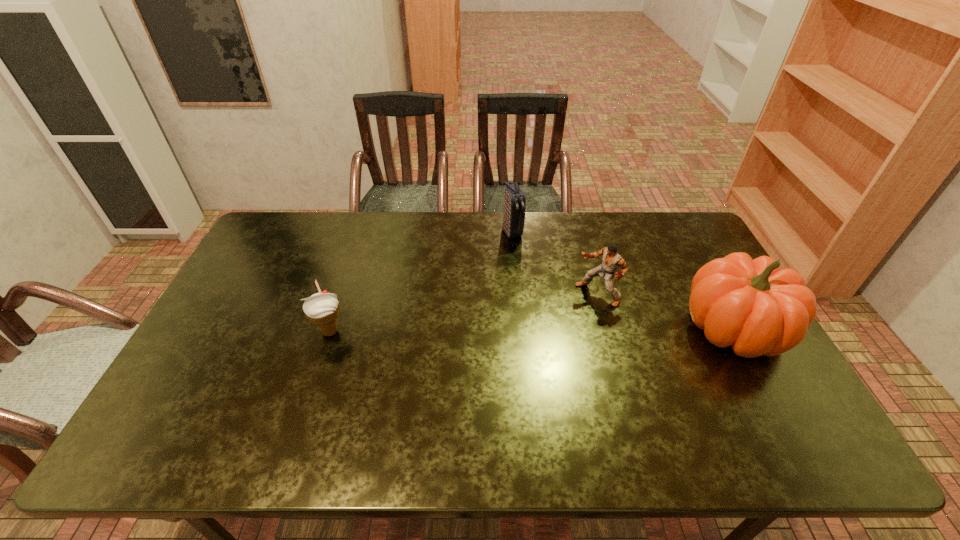
Find the location of `the leftmost object`. the leftmost object is located at coordinates pos(322,309).

Where is `the tallest object`? the tallest object is located at coordinates (751, 305).

You are a GUI agent. You are given a task and a screenshot of the screen. Output one action in this format:
    pyautogui.click(x=<x>, y=<y>)
    Task: Click on the pumpkin
    The width and height of the screenshot is (960, 540).
    Given the screenshot: What is the action you would take?
    pyautogui.click(x=751, y=305)

Where is `the farthest object`? The image size is (960, 540). the farthest object is located at coordinates (514, 199).

This screenshot has width=960, height=540. I want to click on the third object from right to left, so click(514, 199).

The image size is (960, 540). Find the location of `puncher`. puncher is located at coordinates (611, 260).

You are a GUI agent. You are given a task and a screenshot of the screen. Output one action in this format:
    pyautogui.click(x=<x>, y=<y>)
    Task: Click on the vacant region located on the back of the icecream
    This screenshot has width=960, height=540.
    Given the screenshot: What is the action you would take?
    pyautogui.click(x=352, y=263)

At what (x,y) coordinates should I click in order to perform the action: click on vacant space located on the left of the rightmost object. Please return your answer as a coordinate pair (x, y). This screenshot has width=960, height=540. Looking at the image, I should click on (542, 327).

What are the coordinates of `free location located 0.220m with the zip open on the clutch bag` in the screenshot? It's located at (542, 281).

Find the location of a particular element. This screenshot has height=540, width=960. vacant space located with the zip open on the clutch bag is located at coordinates (528, 258).